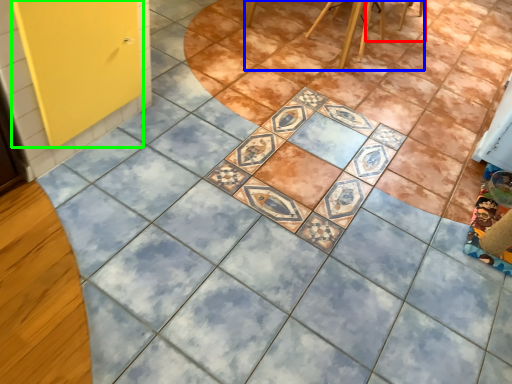
Question: Considering the real-world distances, which object is closest to chair (highlighted by a red box)? furniture (highlighted by a blue box) or screen door (highlighted by a green box).

Choices:
 (A) furniture
 (B) screen door

Answer: (A)